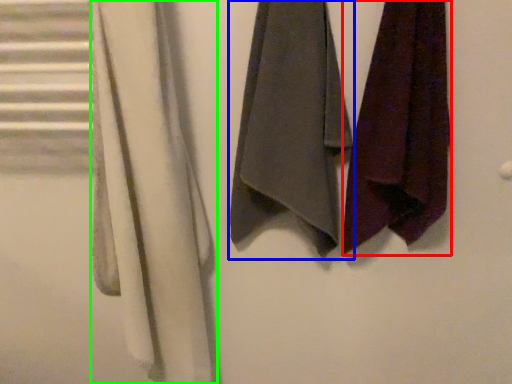
Question: Considering the real-world distances, which object is closest to towel (highlighted by a red box)? towel (highlighted by a blue box) or cloth (highlighted by a green box).

Choices:
 (A) towel
 (B) cloth

Answer: (A)